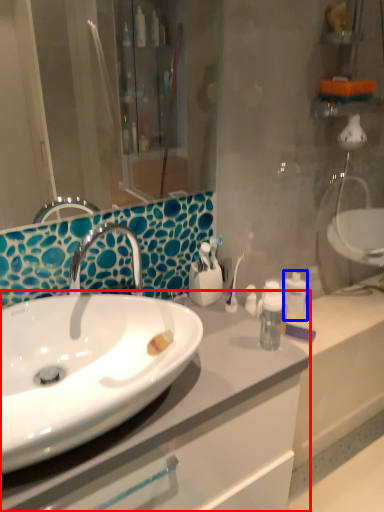
Question: Which of the following is the closest to the observer, bathroom cabinet (highlighted by a red box) or mouthwash (highlighted by a blue box)?

Choices:
 (A) bathroom cabinet
 (B) mouthwash

Answer: (A)